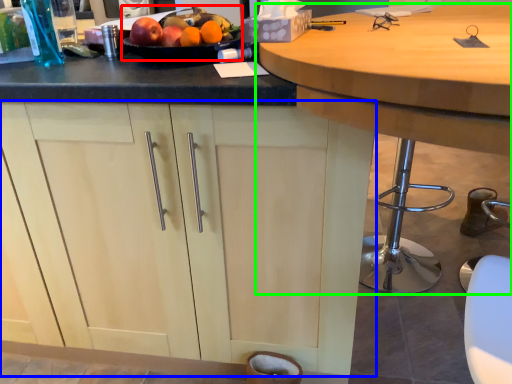
Question: Based on their relative distances, which object is farther from fruit dish (highlighted by a red box)? Choose from cabinetry (highlighted by a blue box) and table (highlighted by a green box).

Choices:
 (A) cabinetry
 (B) table

Answer: (A)